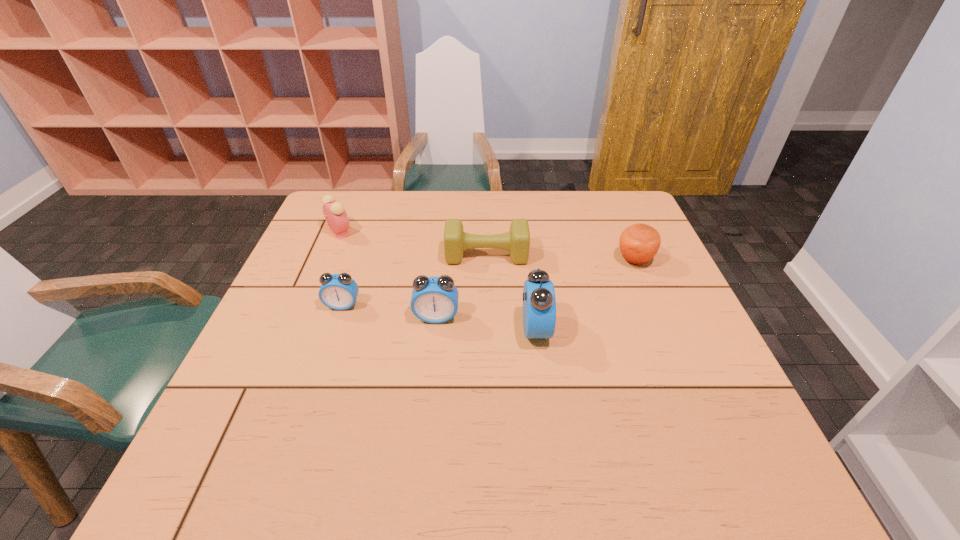
Identify the location of the third alarm clock from left to right. [x=434, y=300].

This screenshot has width=960, height=540. I want to click on the tallest alarm clock, so click(x=539, y=302).

Where is `the tallest object`? the tallest object is located at coordinates (539, 302).

Locate an element on the screen. This screenshot has height=540, width=960. orange is located at coordinates (639, 243).

Locate an element on the screen. The height and width of the screenshot is (540, 960). dumbbell is located at coordinates (517, 241).

The image size is (960, 540). Identify the location of the farthest object. (336, 217).

Locate an element on the screen. Image resolution: width=960 pixels, height=540 pixels. vacant space situated 0.280m on the face of the second alarm clock from right to left is located at coordinates (424, 434).

At what (x,y) coordinates should I click in order to perform the action: click on free space located 0.180m on the face of the tallest object. Please return your answer as a coordinate pair (x, y). This screenshot has width=960, height=540. Looking at the image, I should click on (626, 329).

Locate an element on the screen. The image size is (960, 540). vacant space located on the left of the rightmost object is located at coordinates (547, 260).

Locate an element on the screen. free space located on the right of the dumbbell is located at coordinates (612, 255).